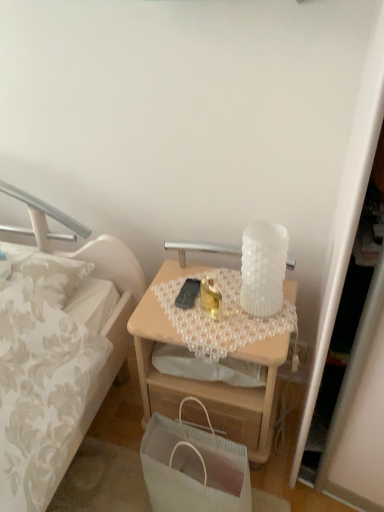
This screenshot has height=512, width=384. Identify the location of free space in front of black matte mobile phone at center. (199, 327).